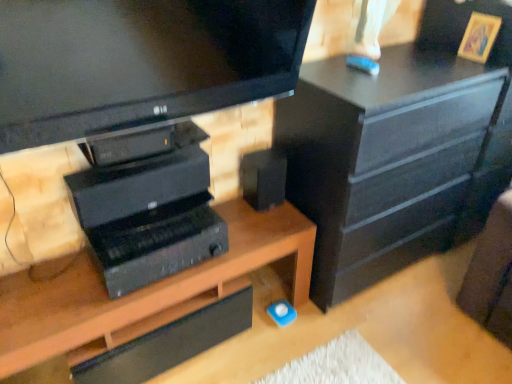
Question: Considering their positions, is wooden desk at center located in front of or behind black matte speaker at center?

Choices:
 (A) front
 (B) behind

Answer: (A)

Question: Based on their sizes in the image, would you say wooden desk at center is bigger or smaller than black matte speaker at center?

Choices:
 (A) small
 (B) big

Answer: (B)

Question: Which object is positioned farthest from the black matte chest of drawers at upper right?

Choices:
 (A) black matte speaker at center
 (B) black plastic computer at center
 (C) wooden desk at center

Answer: (B)

Question: Which is nearer to the black matte chest of drawers at upper right?

Choices:
 (A) wooden desk at center
 (B) black plastic computer at center
 (C) black matte speaker at center

Answer: (C)